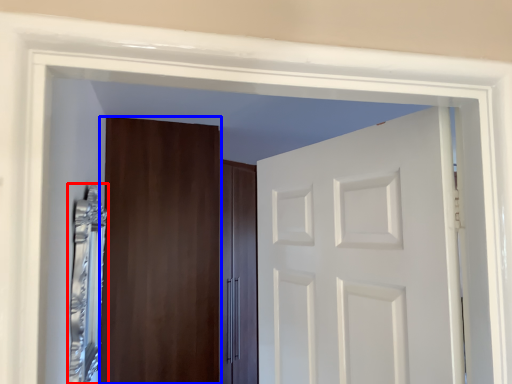
Question: Which object is closer to the camera taking this photo, mirror (highlighted by a red box) or door (highlighted by a blue box)?

Choices:
 (A) mirror
 (B) door

Answer: (A)